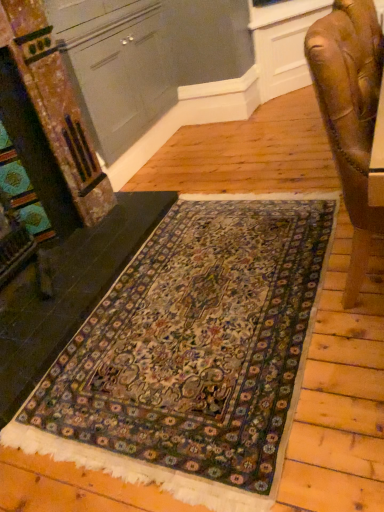
Question: Can you confirm if carpet at lower left is bigger than matte gray cabinet at upper left?

Choices:
 (A) no
 (B) yes

Answer: (A)

Question: Is carpet at lower left closer to the viewer compared to matte gray cabinet at upper left?

Choices:
 (A) yes
 (B) no

Answer: (A)

Question: Does carpet at lower left appear on the right side of matte gray cabinet at upper left?

Choices:
 (A) yes
 (B) no

Answer: (B)

Question: From the image's perspective, is carpet at lower left beneath matte gray cabinet at upper left?

Choices:
 (A) yes
 (B) no

Answer: (A)

Question: Considering the relative sizes of carpet at lower left and matte gray cabinet at upper left in the image provided, is carpet at lower left thinner than matte gray cabinet at upper left?

Choices:
 (A) yes
 (B) no

Answer: (B)

Question: From the image's perspective, is carpet at lower left on matte gray cabinet at upper left?

Choices:
 (A) yes
 (B) no

Answer: (B)

Question: Are carpeted rug at center and matte gray cabinet at upper left located far from each other?

Choices:
 (A) no
 (B) yes

Answer: (B)

Question: Is carpeted rug at center oriented towards matte gray cabinet at upper left?

Choices:
 (A) no
 (B) yes

Answer: (A)

Question: Is the depth of carpeted rug at center less than that of matte gray cabinet at upper left?

Choices:
 (A) no
 (B) yes

Answer: (B)

Question: From the image's perspective, is carpeted rug at center on matte gray cabinet at upper left?

Choices:
 (A) yes
 (B) no

Answer: (B)

Question: Does carpeted rug at center have a smaller size compared to matte gray cabinet at upper left?

Choices:
 (A) yes
 (B) no

Answer: (A)

Question: Is carpeted rug at center to the left of matte gray cabinet at upper left from the viewer's perspective?

Choices:
 (A) no
 (B) yes

Answer: (A)

Question: Does carpet at lower left have a smaller size compared to carpeted rug at center?

Choices:
 (A) no
 (B) yes

Answer: (A)